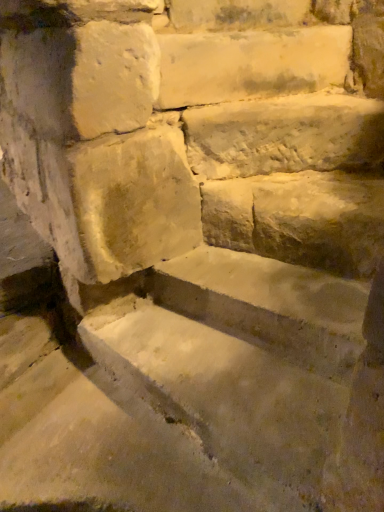
Question: From a real-world perspective, is white rough stone at center, acting as the 1th limestone starting from the bottom, beneath smooth stone brick at upper center?

Choices:
 (A) yes
 (B) no

Answer: (A)

Question: From the image's perspective, does white rough stone at center, acting as the 1th limestone starting from the bottom, appear lower than smooth stone brick at upper center?

Choices:
 (A) yes
 (B) no

Answer: (A)

Question: Is white rough stone at center, acting as the 1th limestone starting from the bottom, positioned before smooth stone brick at upper center?

Choices:
 (A) no
 (B) yes

Answer: (B)

Question: Is white rough stone at center, acting as the 1th limestone starting from the bottom, not near smooth stone brick at upper center?

Choices:
 (A) no
 (B) yes

Answer: (A)

Question: Considering the relative sizes of white rough stone at center, which is the 2th limestone in top-to-bottom order, and smooth stone brick at upper center in the image provided, is white rough stone at center, which is the 2th limestone in top-to-bottom order, bigger than smooth stone brick at upper center?

Choices:
 (A) yes
 (B) no

Answer: (A)

Question: Is white rough stone at center, which is the 2th limestone in top-to-bottom order, positioned with its back to smooth stone brick at upper center?

Choices:
 (A) no
 (B) yes

Answer: (A)

Question: Does smooth stone brick at upper center have a smaller size compared to white rough stone at center, acting as the 1th limestone starting from the bottom?

Choices:
 (A) yes
 (B) no

Answer: (A)

Question: Is smooth stone brick at upper center shorter than white rough stone at center, acting as the 1th limestone starting from the bottom?

Choices:
 (A) no
 (B) yes

Answer: (B)

Question: Is smooth stone brick at upper center outside white rough stone at center, which is the 2th limestone in top-to-bottom order?

Choices:
 (A) no
 (B) yes

Answer: (B)

Question: Is smooth stone brick at upper center next to white rough stone at center, acting as the 1th limestone starting from the bottom?

Choices:
 (A) yes
 (B) no

Answer: (B)

Question: Could you tell me if smooth stone brick at upper center is turned towards white rough stone at center, acting as the 1th limestone starting from the bottom?

Choices:
 (A) yes
 (B) no

Answer: (B)

Question: Can you confirm if smooth stone brick at upper center is thinner than white rough stone at center, acting as the 1th limestone starting from the bottom?

Choices:
 (A) no
 (B) yes

Answer: (B)

Question: From a real-world perspective, is white stone step at upper center, which ranks as the first limestone in top-to-bottom order, on smooth stone brick at upper center?

Choices:
 (A) no
 (B) yes

Answer: (A)